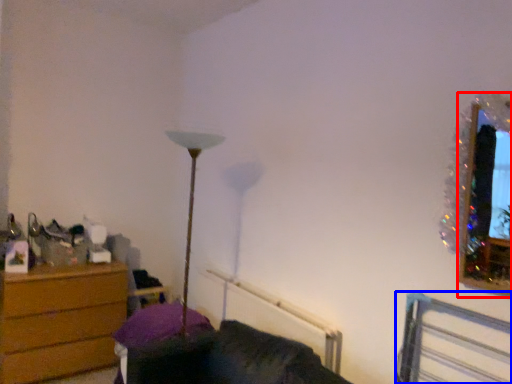
Question: Which point is further to the camera, picture frame (highlighted by a red box) or bed frame (highlighted by a blue box)?

Choices:
 (A) picture frame
 (B) bed frame

Answer: (A)